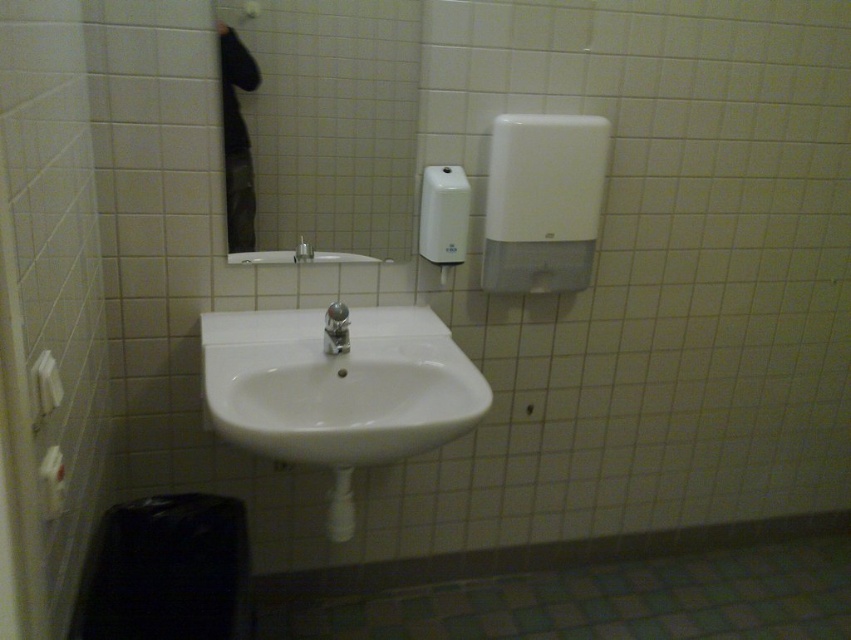
Is point (409, 81) closer to camera compared to point (326, 337)?

That is False.

Which is above, white glossy mirror at upper center or satin chrome faucet at center?

white glossy mirror at upper center is higher up.

Where is `white glossy mirror at upper center`? white glossy mirror at upper center is located at coordinates point(334,124).

Between point (294, 154) and point (248, 324), which one is positioned in front?

Point (294, 154) is in front.

Does white glossy mirror at upper center have a lesser width compared to white glossy sink at center?

Yes, white glossy mirror at upper center is thinner than white glossy sink at center.

At what (x,y) coordinates should I click in order to perform the action: click on white glossy mirror at upper center. Please return your answer as a coordinate pair (x, y). Looking at the image, I should click on (334, 124).

Where is `white glossy mirror at upper center`? The image size is (851, 640). white glossy mirror at upper center is located at coordinates (334, 124).